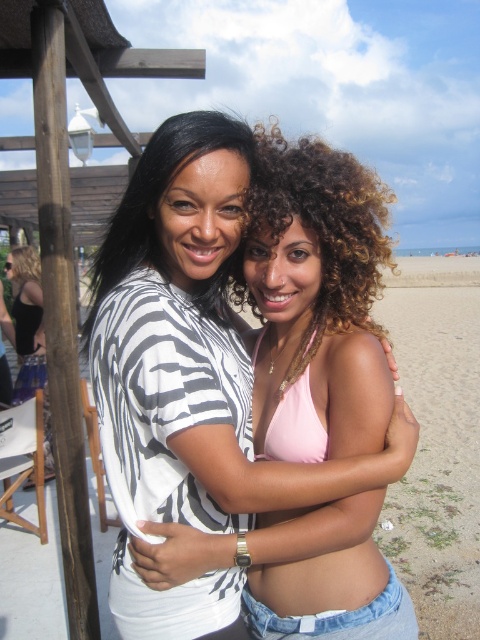
Question: Which point appears closest to the camera in this image?

Choices:
 (A) (27, 275)
 (B) (133, 196)

Answer: (B)

Question: Where is zebra-striped shirt at center located in relation to black matte tank top at left in the image?

Choices:
 (A) left
 (B) right

Answer: (B)

Question: Is white zebra-patterned shirt at center thinner than zebra-striped shirt at center?

Choices:
 (A) yes
 (B) no

Answer: (B)

Question: Which point is farther from the camera taking this photo?

Choices:
 (A) (213, 576)
 (B) (12, 273)
 (C) (142, 154)

Answer: (B)

Question: Can you confirm if white zebra-patterned shirt at center is thinner than black matte tank top at left?

Choices:
 (A) no
 (B) yes

Answer: (B)

Question: Which object is the closest to the black matte tank top at left?

Choices:
 (A) zebra-striped shirt at center
 (B) white zebra-patterned shirt at center

Answer: (A)